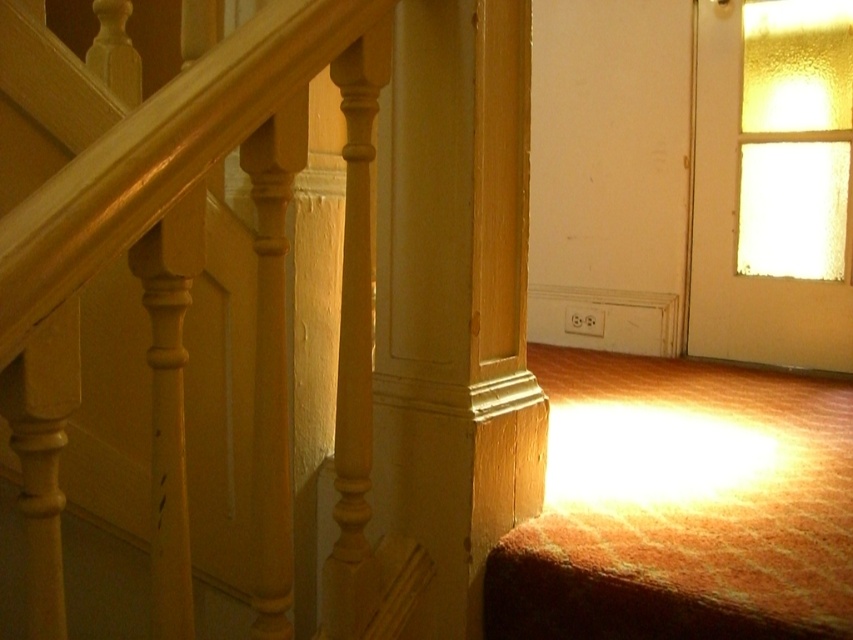
Can you confirm if matte wood railing at upper left is shorter than wooden post at center?

No.

Between point (334, 349) and point (505, 230), which one is positioned in front?

Point (505, 230)

Is point (3, 445) farther from viewer compared to point (440, 225)?

No, (3, 445) is closer to viewer.

Where is `matte wood railing at upper left`? The width and height of the screenshot is (853, 640). matte wood railing at upper left is located at coordinates (178, 301).